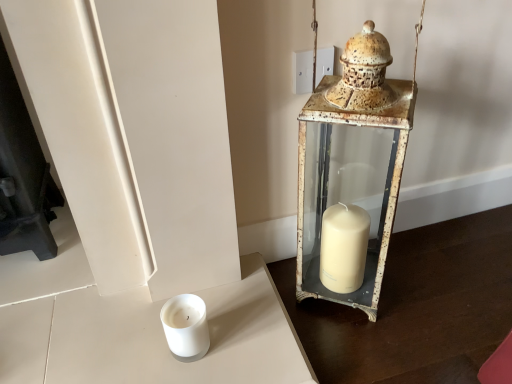
Question: In the image, is white matte candle at lower left positioned in front of or behind rusty metal lantern at right?

Choices:
 (A) behind
 (B) front

Answer: (A)

Question: Does point (207, 339) appear closer or farther from the camera than point (324, 238)?

Choices:
 (A) closer
 (B) farther

Answer: (A)

Question: Would you say white matte candle at lower left is to the left or to the right of rusty metal lantern at right in the picture?

Choices:
 (A) left
 (B) right

Answer: (A)

Question: Visually, is rusty metal lantern at right positioned to the left or to the right of white matte candle at lower left?

Choices:
 (A) right
 (B) left

Answer: (A)

Question: Considering the positions of rusty metal lantern at right and white matte candle at lower left in the image, is rusty metal lantern at right wider or thinner than white matte candle at lower left?

Choices:
 (A) thin
 (B) wide

Answer: (B)

Question: Is rusty metal lantern at right taller or shorter than white matte candle at lower left?

Choices:
 (A) short
 (B) tall

Answer: (B)

Question: Is rusty metal lantern at right inside or outside of white matte candle at lower left?

Choices:
 (A) inside
 (B) outside

Answer: (B)